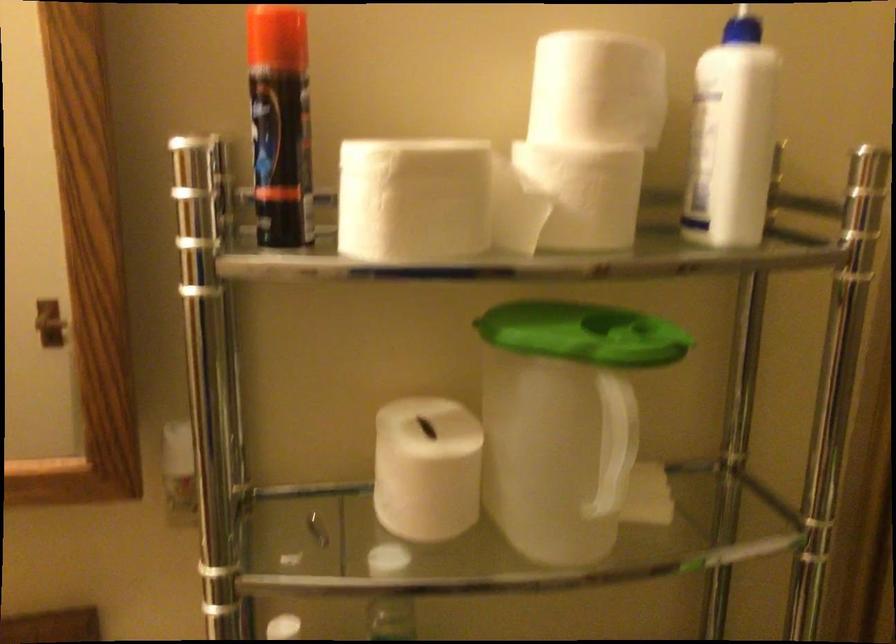
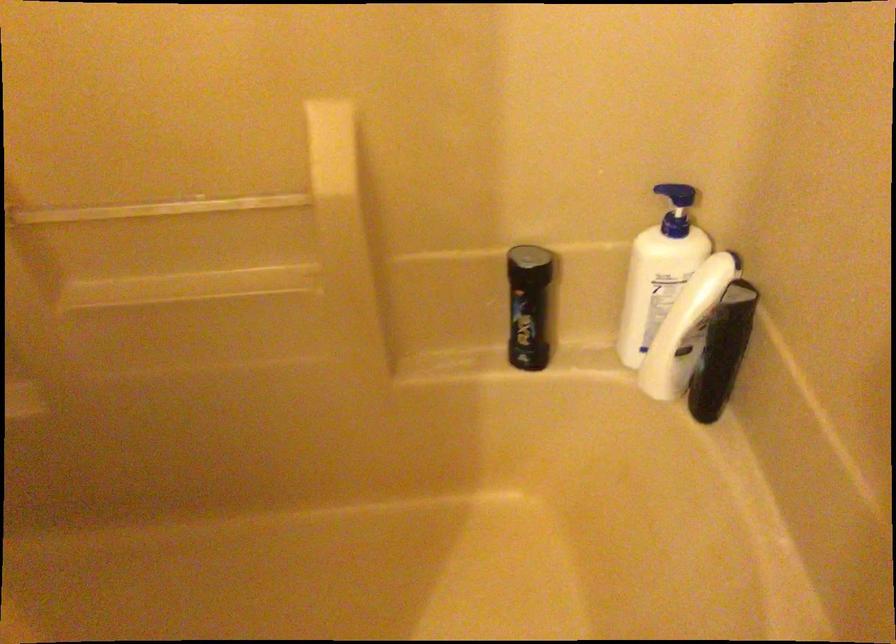
First-person continuous shooting, in which direction is the camera rotating?

The rotation direction of the camera is right-down.